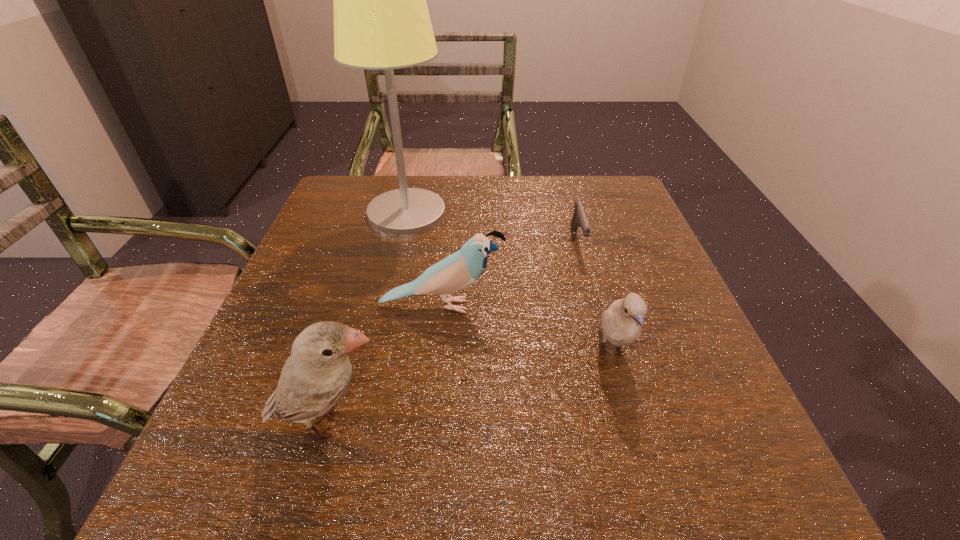
Where is `the tallest object`? The image size is (960, 540). the tallest object is located at coordinates (381, 20).

This screenshot has height=540, width=960. I want to click on the nearest bird, so click(x=318, y=372).

Find the location of a particular element. The width and height of the screenshot is (960, 540). the tallest bird is located at coordinates (318, 372).

Where is `the farthest bird`? The image size is (960, 540). the farthest bird is located at coordinates (457, 271).

You are a GUI agent. You are given a task and a screenshot of the screen. Output one action in this format:
    pyautogui.click(x=<x>, y=<y>)
    Task: Click on the rightmost bird
    This screenshot has height=540, width=960.
    Given the screenshot: What is the action you would take?
    pyautogui.click(x=621, y=324)

Identify the location of the second nearest object. (621, 324).

The height and width of the screenshot is (540, 960). Identify the location of the shortest object. (579, 218).

Find the location of `vacant space located 0.290m on the front of the table lamp`. vacant space located 0.290m on the front of the table lamp is located at coordinates (380, 330).

Where is `free space located at the face of the nearest bird`? Image resolution: width=960 pixels, height=540 pixels. free space located at the face of the nearest bird is located at coordinates (575, 424).

I want to click on free space located at the face of the third farthest object, so click(x=636, y=306).